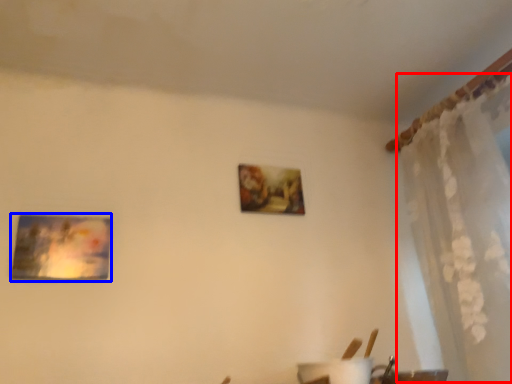
Question: Which object appears farthest to the camera in this image, curtain (highlighted by a red box) or picture frame (highlighted by a blue box)?

Choices:
 (A) curtain
 (B) picture frame

Answer: (B)